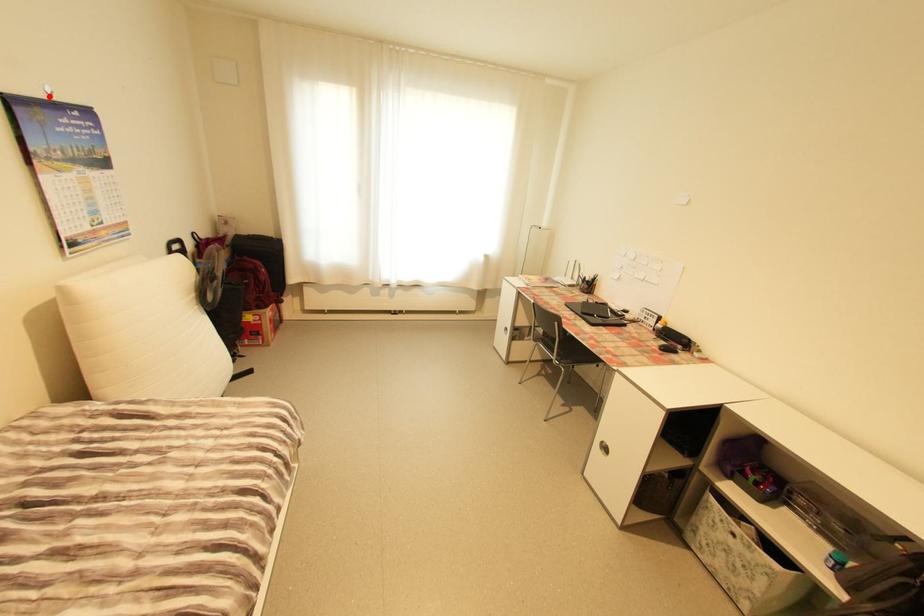
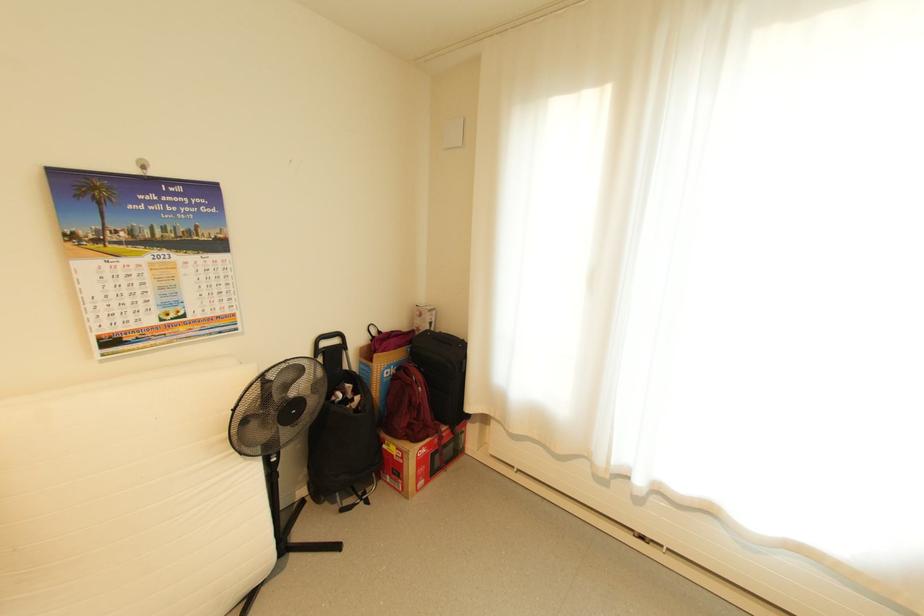
The point at the highlighted location is marked in the first image. Where is the corresponding point in the second image?

(140, 172)